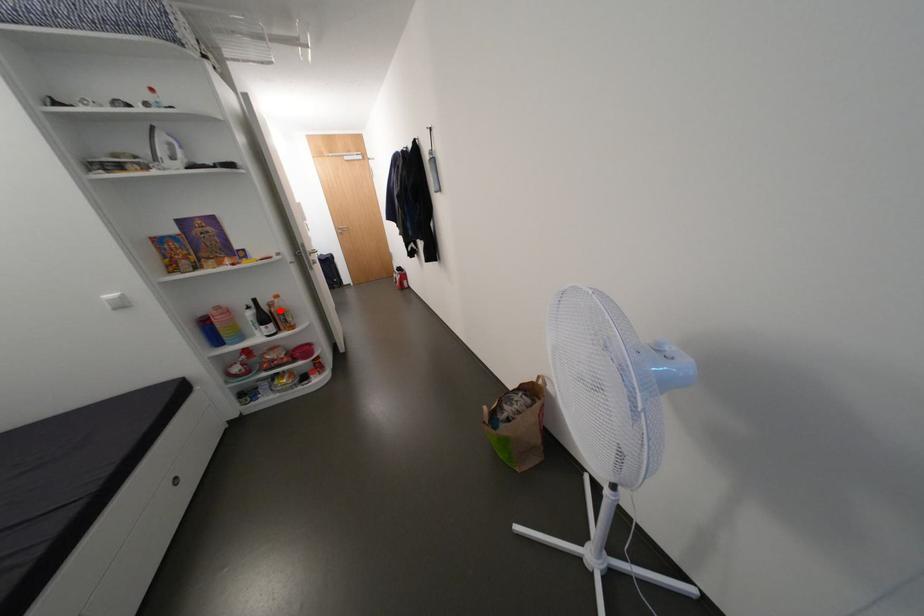
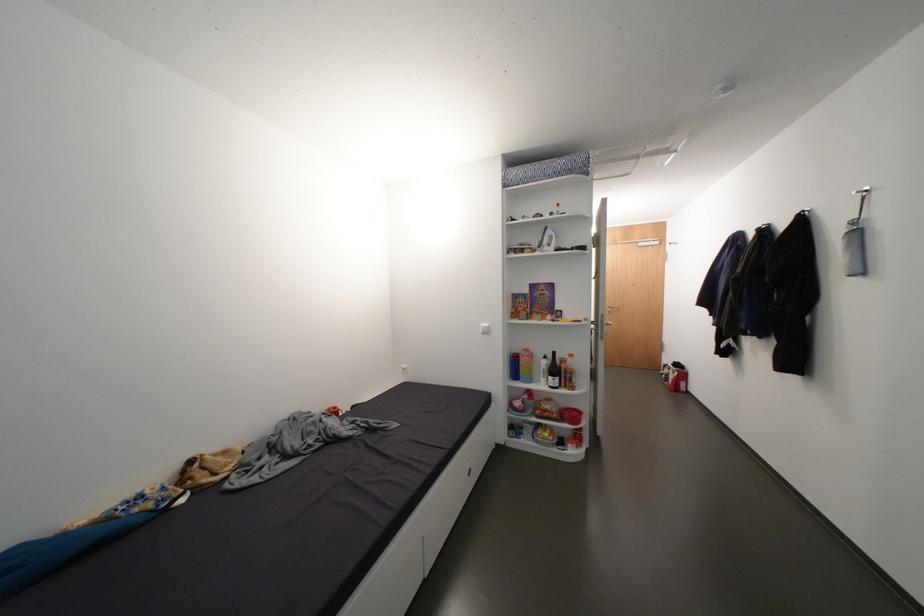
Question: A red point is marked in image1. In image2, is the corresponding 3D point closer to the camera or farther? Reply with the corresponding letter.

Choices:
 (A) The corresponding 3D point is closer.
 (B) The corresponding 3D point is farther.

Answer: (B)